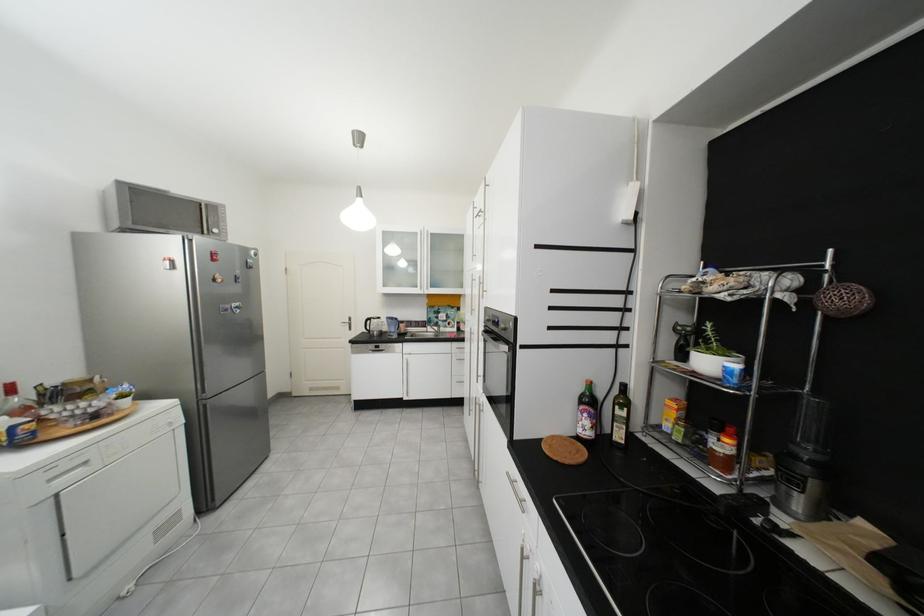
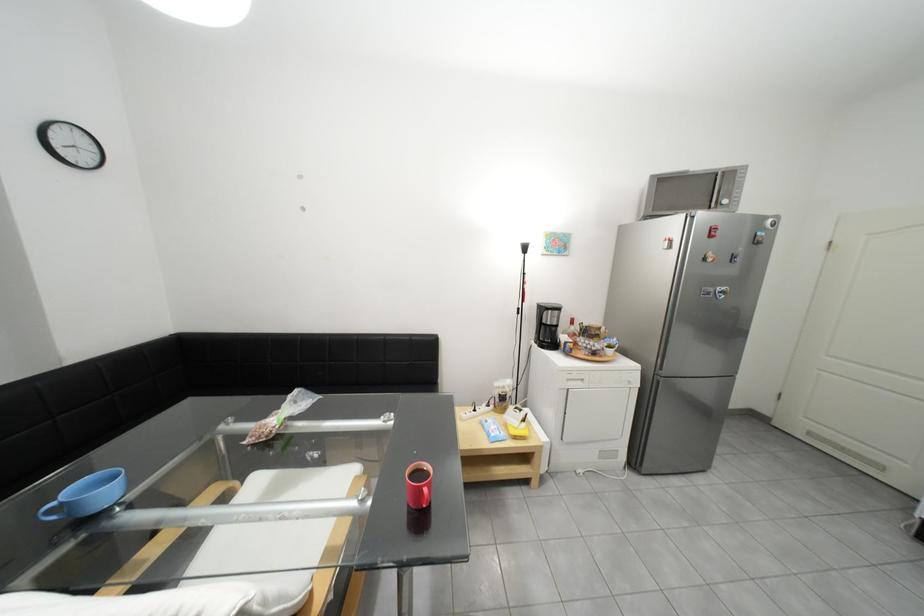
Question: The first image is from the beginning of the video and the second image is from the end. How did the camera likely rotate when shooting the video?

Choices:
 (A) Left
 (B) Right
 (C) Up
 (D) Down

Answer: (A)